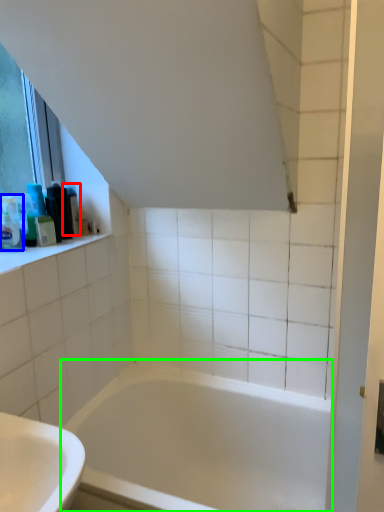
Question: Estimate the real-world distances between objects in this image. Which object is closer to toiletry (highlighted by a red box), toiletry (highlighted by a blue box) or bathtub (highlighted by a green box)?

Choices:
 (A) toiletry
 (B) bathtub

Answer: (A)